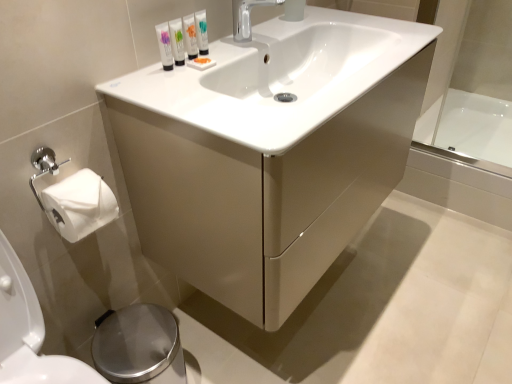
In order to click on free space to the right of matte white tube at upper center, the second mouthwash when ordered from right to left in this screenshot , I will do `click(238, 55)`.